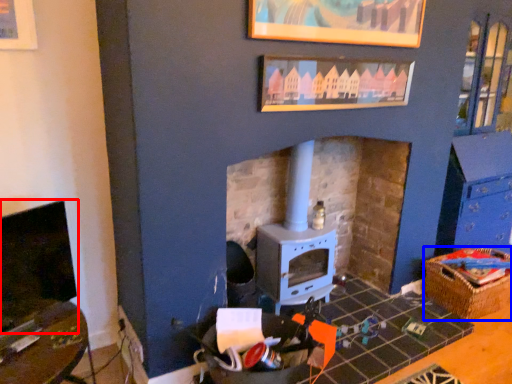
Question: Which object appears farthest to the camera in this image, fireplace (highlighted by a red box) or crate (highlighted by a blue box)?

Choices:
 (A) fireplace
 (B) crate

Answer: (B)